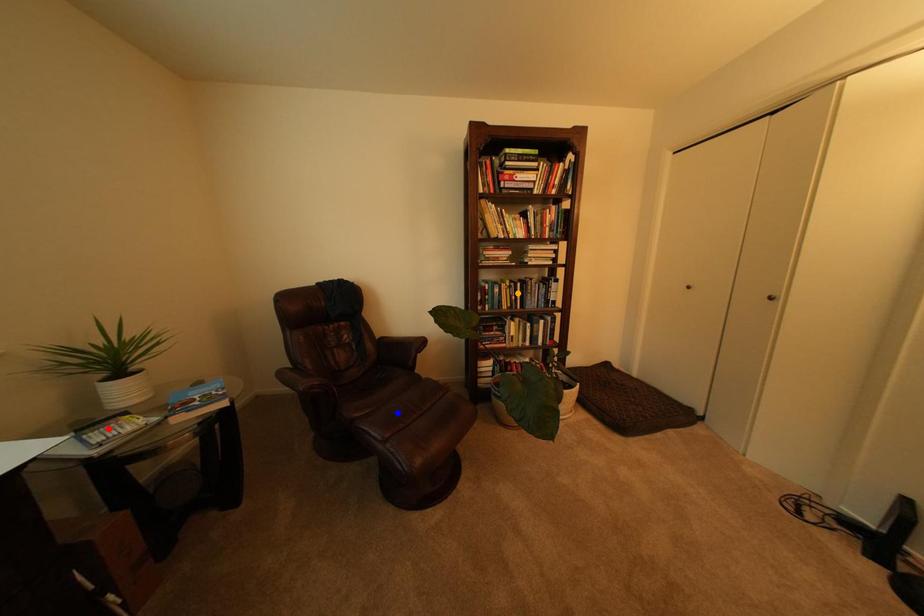
Order these from nearest to farthest:
A) red point
B) blue point
C) orange point

orange point → blue point → red point